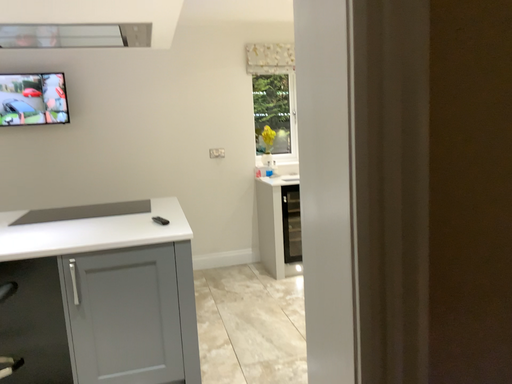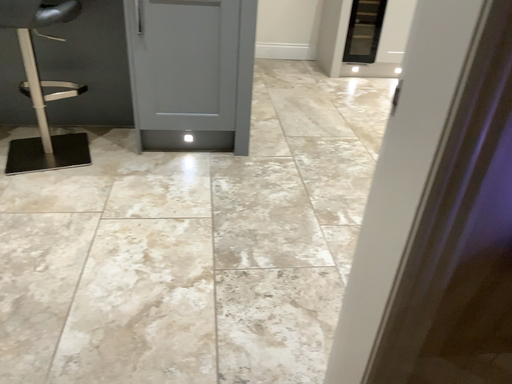
Question: Which way did the camera rotate in the video?

Choices:
 (A) rotated upward
 (B) rotated downward

Answer: (B)